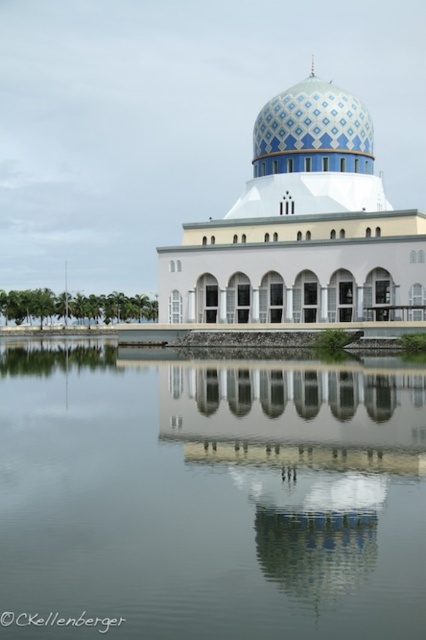
Is transparent glass water at center taller than blue mosaic dome at center?

No.

Between point (302, 410) and point (259, 129), which one is positioned behind?

The point (259, 129) is behind.

Who is more forward, (282, 580) or (293, 154)?

Positioned in front is point (282, 580).

You are a GUI agent. You are given a task and a screenshot of the screen. Output one action in this format:
    pyautogui.click(x=<x>, y=<y>)
    Task: Click on the transparent glass water at center
    The width and height of the screenshot is (426, 640).
    Given the screenshot: What is the action you would take?
    pyautogui.click(x=209, y=497)

Is transparent glass water at center taller than blue glossy dome at center?

Incorrect, transparent glass water at center's height is not larger of blue glossy dome at center's.

Locate an element on the screen. transparent glass water at center is located at coordinates (209, 497).

Which is behind, point (100, 429) or point (394, 284)?

Point (394, 284)

You are a GUI agent. You are given a task and a screenshot of the screen. Output one action in this format:
    pyautogui.click(x=<x>, y=<y>)
    Task: Click on the transparent glass water at center
    This screenshot has height=640, width=426.
    Given the screenshot: What is the action you would take?
    pyautogui.click(x=209, y=497)

Which is above, blue glossy dome at center or blue mosaic dome at center?

blue mosaic dome at center

Which of these two, blue glossy dome at center or blue mosaic dome at center, stands taller?

Standing taller between the two is blue glossy dome at center.

Who is more forward, (247, 252) or (313, 132)?

Point (247, 252)

You are a GUI agent. You are given a task and a screenshot of the screen. Output one action in this format:
    pyautogui.click(x=<x>, y=<y>)
    Task: Click on the blue glossy dome at center
    The width and height of the screenshot is (426, 640).
    Given the screenshot: What is the action you would take?
    pyautogui.click(x=301, y=227)